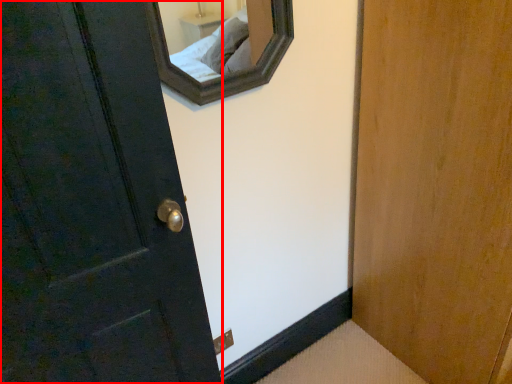
Question: Considering the relative positions of door (annotated by the red box) and electric outlet in the image provided, where is door (annotated by the red box) located with respect to the staircase?

Choices:
 (A) right
 (B) left

Answer: (B)